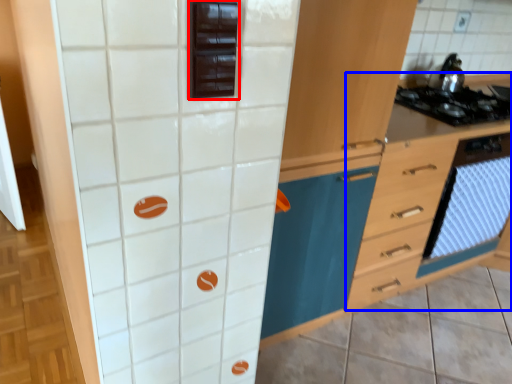
Question: Among these objects, which one is nearest to the camera, appliance (highlighted by a red box) or file cabinet (highlighted by a blue box)?

Choices:
 (A) appliance
 (B) file cabinet

Answer: (A)